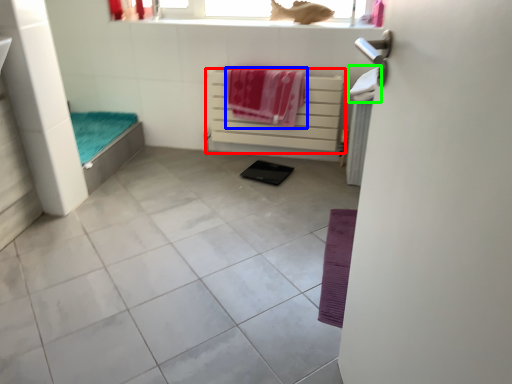
Question: Which is farther away from balustrade (highlighted by a red box)? beach towel (highlighted by a blue box) or beach towel (highlighted by a green box)?

Choices:
 (A) beach towel
 (B) beach towel

Answer: (B)